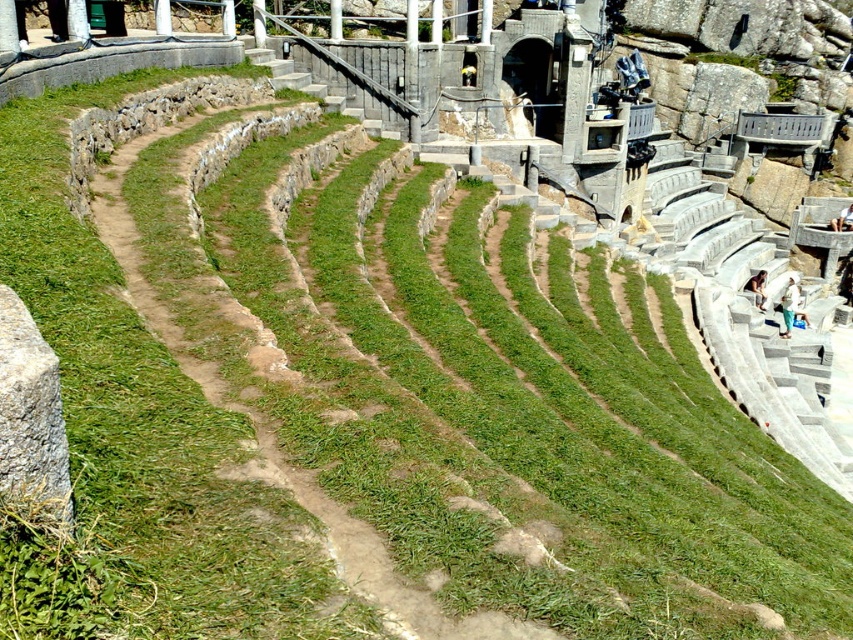
Can you confirm if gray rough stone at lower left is bigger than white cotton shirt at lower right?

No.

Consider the image. Between gray rough stone at lower left and white cotton shirt at lower right, which one is positioned lower?

gray rough stone at lower left

Identify the location of gray rough stone at lower left. (30, 417).

At what (x,y) coordinates should I click in order to perform the action: click on gray rough stone at lower left. Please return your answer as a coordinate pair (x, y). The image size is (853, 640). Looking at the image, I should click on (30, 417).

Does gray rough stone at lower left have a smaller size compared to light brown stone person at lower right?

Indeed, gray rough stone at lower left has a smaller size compared to light brown stone person at lower right.

The image size is (853, 640). What do you see at coordinates (30, 417) in the screenshot?
I see `gray rough stone at lower left` at bounding box center [30, 417].

The width and height of the screenshot is (853, 640). What are the coordinates of `gray rough stone at lower left` in the screenshot? It's located at (30, 417).

Locate an element on the screen. The width and height of the screenshot is (853, 640). gray rough stone at lower left is located at coordinates (30, 417).

Who is positioned more to the left, white cotton shirt at lower right or light brown stone person at lower right?

light brown stone person at lower right is more to the left.

Consider the image. Does white cotton shirt at lower right have a lesser height compared to light brown stone person at lower right?

Incorrect, white cotton shirt at lower right's height does not fall short of light brown stone person at lower right's.

Which is behind, point (787, 314) or point (759, 301)?

The point (759, 301) is behind.

This screenshot has height=640, width=853. What are the coordinates of `white cotton shirt at lower right` in the screenshot? It's located at (x=788, y=305).